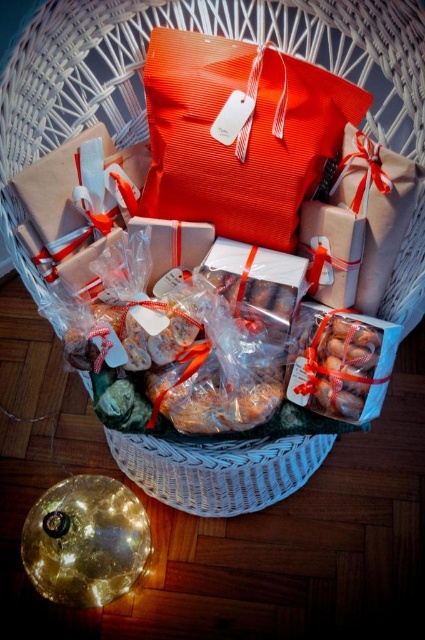
Question: Which point is farther to the camera?

Choices:
 (A) translucent plastic bag of cookies at center
 (B) matte orange fabric gift bag at center

Answer: (A)

Question: Does matte orange fabric gift bag at center have a larger size compared to translucent plastic bag of cookies at center?

Choices:
 (A) yes
 (B) no

Answer: (A)

Question: Can you confirm if matte orange fabric gift bag at center is wider than translucent plastic bag of cookies at center?

Choices:
 (A) no
 (B) yes

Answer: (B)

Question: Among these points, which one is farthest from the camera?

Choices:
 (A) (319, 330)
 (B) (218, 131)

Answer: (A)

Question: Can you confirm if matte orange fabric gift bag at center is positioned above translucent plastic bag of cookies at center?

Choices:
 (A) no
 (B) yes

Answer: (B)